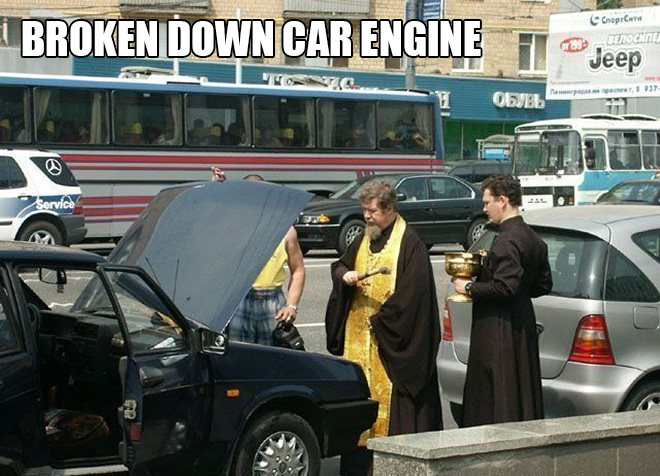
This screenshot has height=476, width=660. I want to click on wall, so click(598, 456).